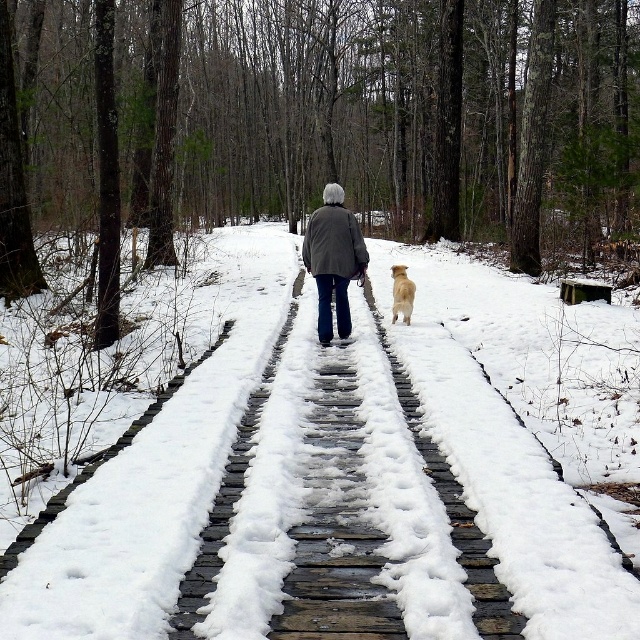
Is white powder snow at center thinner than golden fur dog at center?

In fact, white powder snow at center might be wider than golden fur dog at center.

Is white powder snow at center smaller than golden fur dog at center?

Actually, white powder snow at center might be larger than golden fur dog at center.

Which is behind, point (387, 323) or point (410, 314)?

Positioned behind is point (387, 323).

Identify the location of white powder snow at center. (336, 496).

Who is positioned more to the left, dark gray jacket at center or golden fur dog at center?

dark gray jacket at center is more to the left.

Is dark gray jacket at center closer to camera compared to golden fur dog at center?

That is True.

This screenshot has height=640, width=640. I want to click on dark gray jacket at center, so click(333, 259).

Can you confirm if white powder snow at center is wider than dark gray jacket at center?

Indeed, white powder snow at center has a greater width compared to dark gray jacket at center.

Is white powder snow at center positioned in front of dark gray jacket at center?

Yes, white powder snow at center is in front of dark gray jacket at center.

Where is `white powder snow at center`? Image resolution: width=640 pixels, height=640 pixels. white powder snow at center is located at coordinates (336, 496).